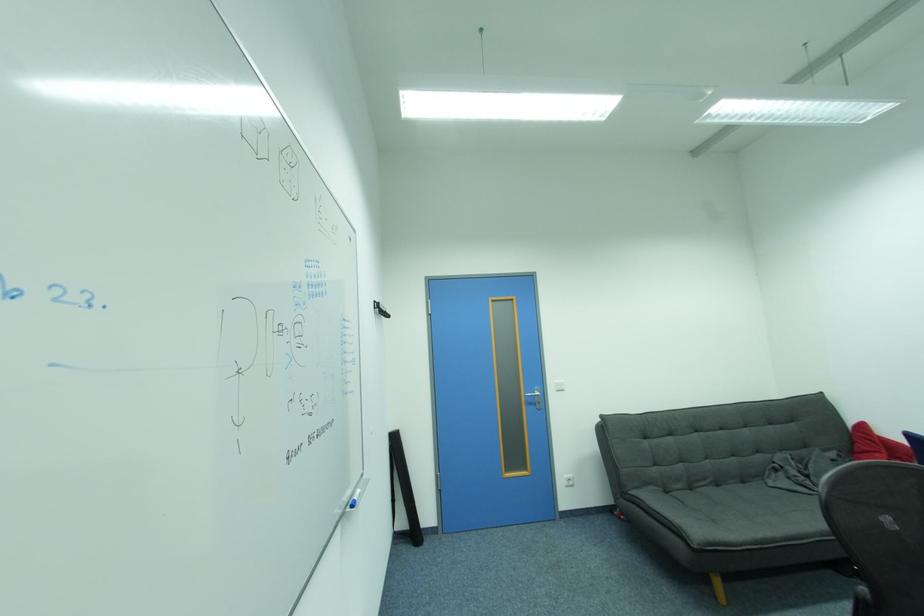
Find the location of a particular element. The width and height of the screenshot is (924, 616). silver door handle is located at coordinates (536, 397).